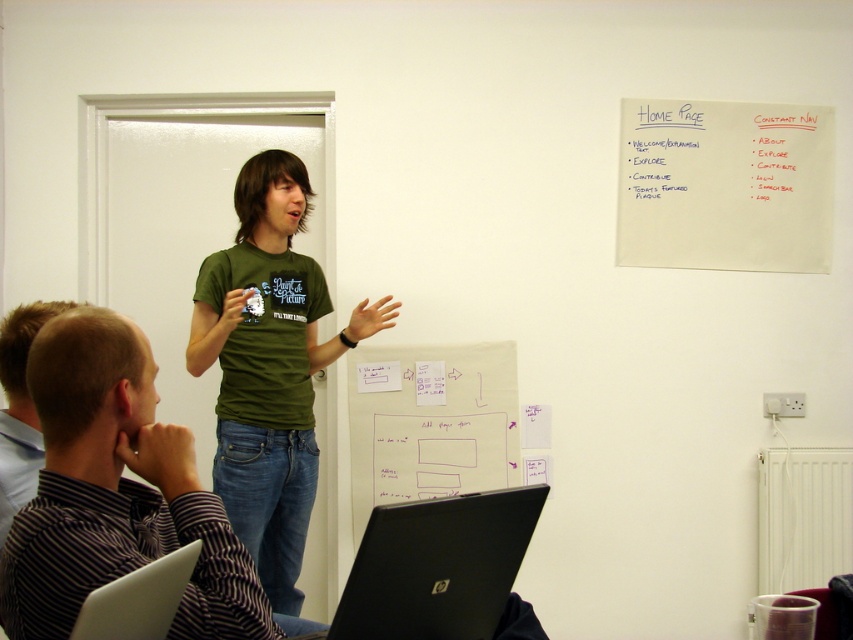
Question: Which is farther from the white glossy laptop at lower left?

Choices:
 (A) green matte shirt at center
 (B) black matte laptop at lower center
 (C) white paper at center
 (D) green t-shirt at center

Answer: (C)

Question: Which point is closer to the camera?

Choices:
 (A) green t-shirt at center
 (B) black matte laptop at lower center
 (C) green matte shirt at center

Answer: (C)

Question: Can you confirm if green t-shirt at center is positioned to the left of white paper at center?

Choices:
 (A) no
 (B) yes

Answer: (B)

Question: Is green matte shirt at center further to the viewer compared to green t-shirt at center?

Choices:
 (A) no
 (B) yes

Answer: (A)

Question: Which of the following is the farthest from the observer?

Choices:
 (A) green t-shirt at center
 (B) white paper at center

Answer: (B)

Question: Is green matte shirt at center further to the viewer compared to black matte laptop at lower center?

Choices:
 (A) no
 (B) yes

Answer: (A)